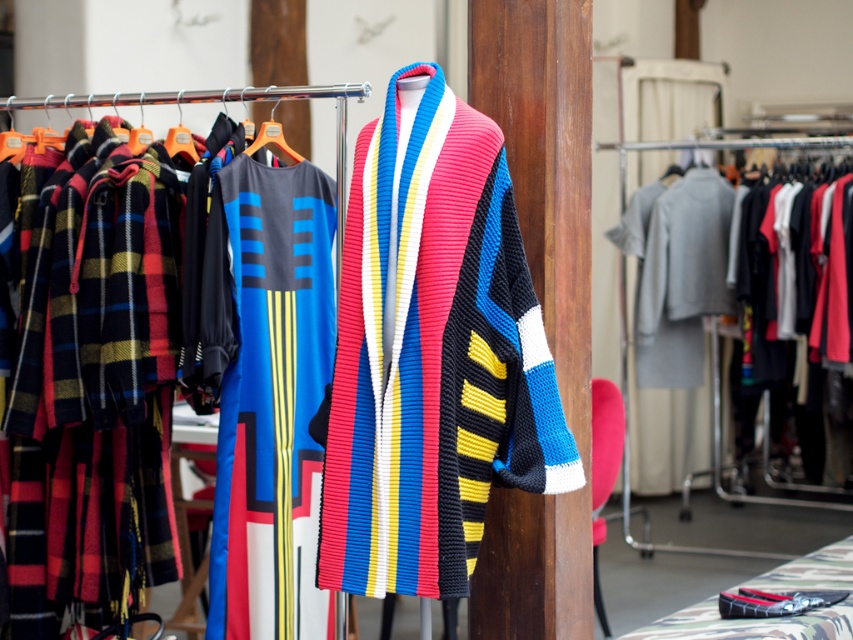
Can you confirm if knitted multicolored sweater at center is wider than knitted wool sweater at center?

No, knitted multicolored sweater at center is not wider than knitted wool sweater at center.

Does knitted multicolored sweater at center appear under knitted wool sweater at center?

Yes.

Is point (438, 262) positioned after point (160, 524)?

No.

Where is `knitted multicolored sweater at center`? The height and width of the screenshot is (640, 853). knitted multicolored sweater at center is located at coordinates (431, 353).

Is knitted fabric dress at center closer to the viewer compared to orange plastic hanger at center?

Yes, it is.

Is knitted fabric dress at center bigger than orange plastic hanger at center?

Yes.

In order to click on knitted fabric dress at center in this screenshot , I will do `click(273, 403)`.

Based on the photo, is knitted multicolored sweater at center below orange plastic hanger at center?

Indeed, knitted multicolored sweater at center is positioned under orange plastic hanger at center.

Describe the element at coordinates (431, 353) in the screenshot. I see `knitted multicolored sweater at center` at that location.

The width and height of the screenshot is (853, 640). Find the location of `knitted multicolored sweater at center`. knitted multicolored sweater at center is located at coordinates (431, 353).